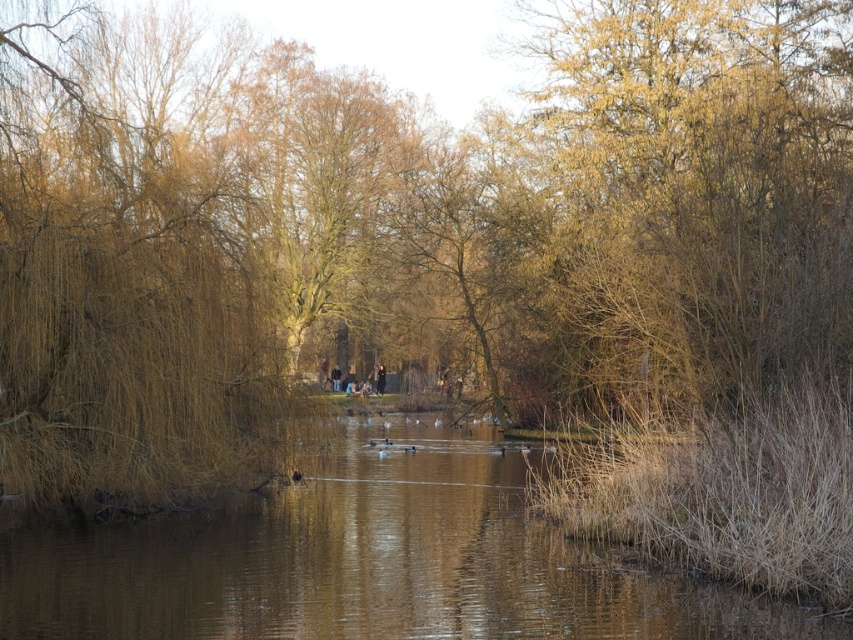
Is brown grassy willow at left positioned in front of brown grassy lake at center?

No, brown grassy willow at left is further to the viewer.

Does brown grassy willow at left appear on the left side of brown grassy lake at center?

Indeed, brown grassy willow at left is positioned on the left side of brown grassy lake at center.

Identify the location of brown grassy willow at left. (132, 269).